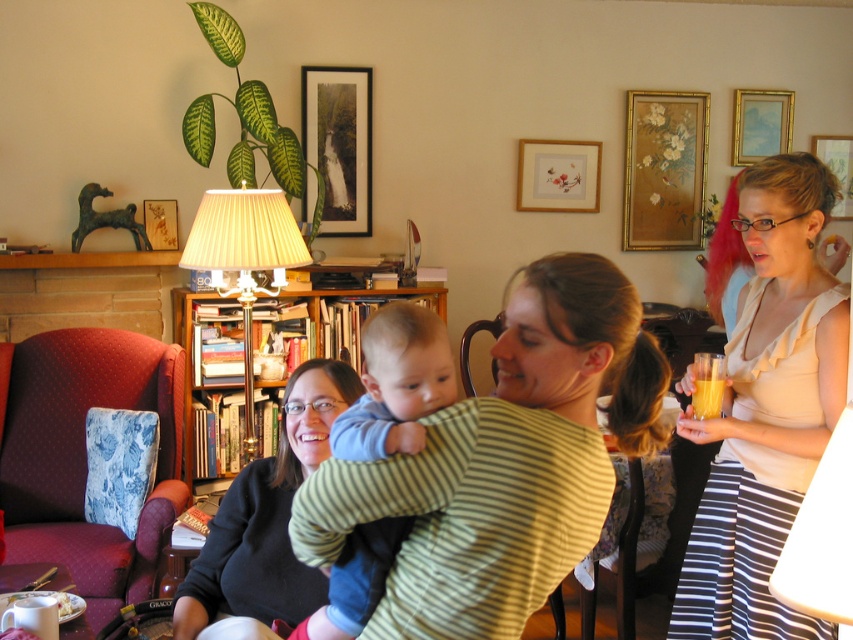
Does black sweater at center have a lesser height compared to wooden bookshelf at center?

Indeed, black sweater at center has a lesser height compared to wooden bookshelf at center.

Does black sweater at center appear on the right side of wooden bookshelf at center?

Indeed, black sweater at center is positioned on the right side of wooden bookshelf at center.

Describe the element at coordinates (267, 516) in the screenshot. This screenshot has height=640, width=853. I see `black sweater at center` at that location.

Identify the location of black sweater at center. The image size is (853, 640). (267, 516).

What do you see at coordinates (767, 408) in the screenshot? Image resolution: width=853 pixels, height=640 pixels. I see `beige sleeveless top at right` at bounding box center [767, 408].

Which is in front, point (784, 611) or point (492, 376)?

Positioned in front is point (784, 611).

Between point (813, 234) and point (634, 502), which one is positioned in front?

Point (813, 234) is in front.

Where is `beige sleeveless top at right`? The height and width of the screenshot is (640, 853). beige sleeveless top at right is located at coordinates coord(767,408).

Does beige sleeveless top at right have a greater height compared to blue cotton onesie at center?

Indeed, beige sleeveless top at right has a greater height compared to blue cotton onesie at center.

Between beige sleeveless top at right and blue cotton onesie at center, which one is positioned higher?

beige sleeveless top at right is above.

Does point (755, 358) come closer to viewer compared to point (419, 316)?

No.

Identify the location of beige sleeveless top at right. coord(767,408).